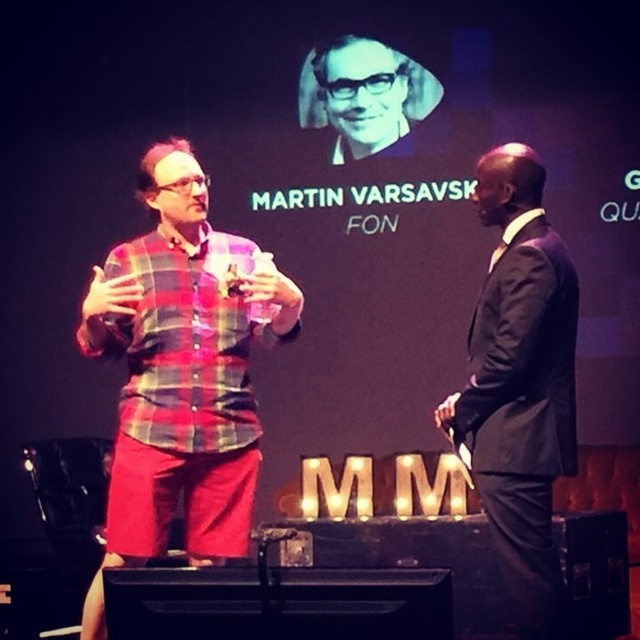
You are standing in front of the stage and want to determine which of the two points, point (538, 314) or point (314, 122), is closer to you. Based on the scene description, which point is nearer?

Point (538, 314) is closer to the viewer than point (314, 122).

You are an event planner trying to arrange a photo shoot for the stage setup. You need to position a spotlight that will illuminate both the plaid fabric shirt at left and the matte black glasses at upper center. Since the spotlight can only cover a 90 degree angle, will the angle between the two objects be within this limit?

The plaid fabric shirt at left is to the left of matte black glasses at upper center, so the angle between them is likely within the 90 degree coverage of the spotlight.

You are an event organizer who needs to arrange seating for a panel discussion. The panelists are wearing the plaid fabric shirt at left and the black satin suit at right. Which panelist should you seat closer to the audience to maintain their current spatial relationship?

The plaid fabric shirt at left is further to the viewer than the black satin suit at right, so to maintain their current spatial relationship, you should seat the plaid fabric shirt at left closer to the audience since they are already positioned closer in the image.